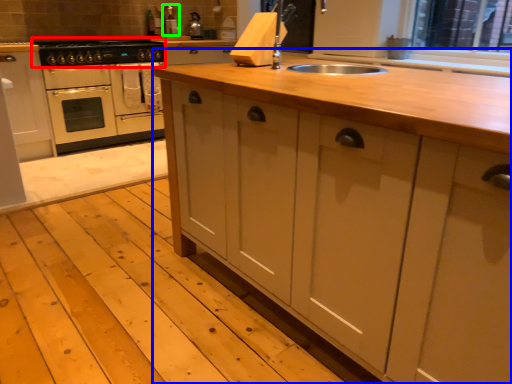
Question: Considering the real-world distances, which object is farthest from gas stove (highlighted by a red box)? countertop (highlighted by a blue box) or appliance (highlighted by a green box)?

Choices:
 (A) countertop
 (B) appliance

Answer: (A)